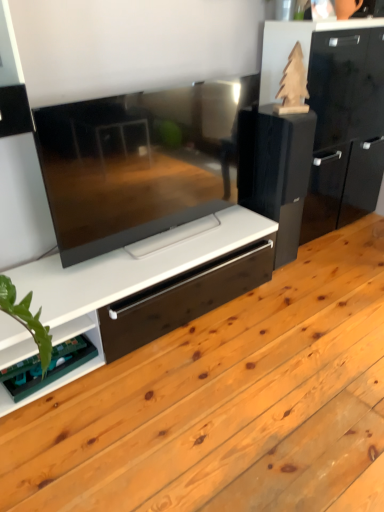
Question: From the image's perspective, is green circuit board at lower left located beneath black glossy speaker at upper right?

Choices:
 (A) no
 (B) yes

Answer: (B)

Question: Is green circuit board at lower left far from black glossy speaker at upper right?

Choices:
 (A) no
 (B) yes

Answer: (B)

Question: Is green circuit board at lower left in contact with black glossy speaker at upper right?

Choices:
 (A) yes
 (B) no

Answer: (B)

Question: Could you tell me if green circuit board at lower left is turned towards black glossy speaker at upper right?

Choices:
 (A) no
 (B) yes

Answer: (A)

Question: Is green circuit board at lower left taller than black glossy speaker at upper right?

Choices:
 (A) no
 (B) yes

Answer: (A)

Question: Is green circuit board at lower left shorter than black glossy speaker at upper right?

Choices:
 (A) yes
 (B) no

Answer: (A)

Question: Is black glossy speaker at upper right to the right of green circuit board at lower left from the viewer's perspective?

Choices:
 (A) no
 (B) yes

Answer: (B)

Question: Is black glossy speaker at upper right further to camera compared to green circuit board at lower left?

Choices:
 (A) yes
 (B) no

Answer: (A)

Question: Can you confirm if black glossy speaker at upper right is wider than green circuit board at lower left?

Choices:
 (A) yes
 (B) no

Answer: (A)

Question: Would you say green circuit board at lower left is part of black glossy speaker at upper right's contents?

Choices:
 (A) no
 (B) yes

Answer: (A)

Question: From the image's perspective, is black glossy speaker at upper right located beneath green circuit board at lower left?

Choices:
 (A) yes
 (B) no

Answer: (B)

Question: Considering the relative sizes of black glossy speaker at upper right and green circuit board at lower left in the image provided, is black glossy speaker at upper right shorter than green circuit board at lower left?

Choices:
 (A) no
 (B) yes

Answer: (A)

Question: From a real-world perspective, is green circuit board at lower left above or below black glossy speaker at upper right?

Choices:
 (A) below
 (B) above

Answer: (A)